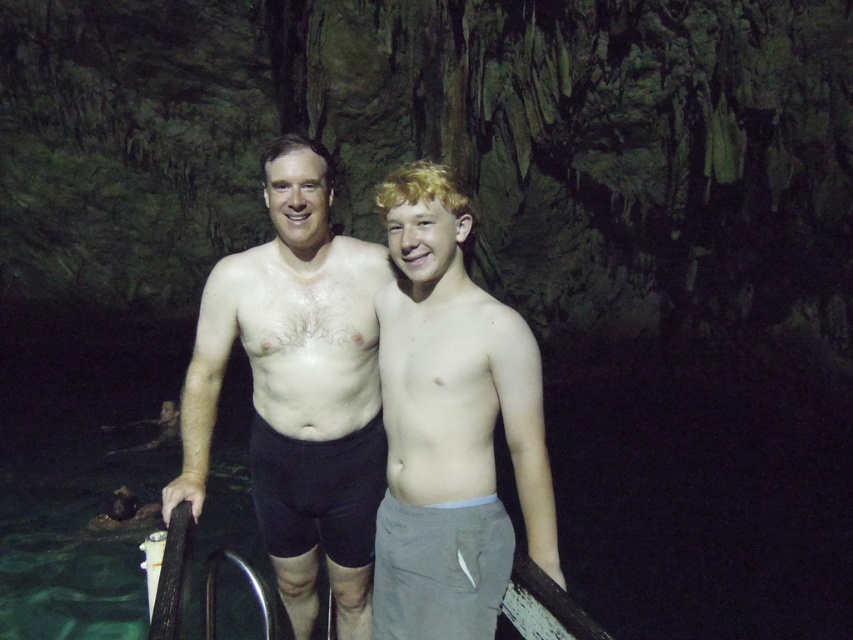
You are a photographer trying to capture the scene with a camera that has a limited focus range. You need to ensure that both the smooth skin torso at center and the light brown cotton shorts at center are in focus. Given that the focus range can only accommodate one of the objects due to their size difference, which object should you prioritize focusing on to ensure it is clear?

The smooth skin torso at center is bigger than light brown cotton shorts at center, so you should prioritize focusing on the smooth skin torso at center to ensure it is clear within the limited focus range.

You are standing in a dark forest clearing and see a smooth skin torso at center. You want to move closer to it without being seen. What is the minimum distance you should keep to avoid being noticed?

The smooth skin torso at center and viewer are 2.32 meters apart from each other. To avoid being noticed, you should keep a minimum distance of at least 2.32 meters away from the smooth skin torso at center.